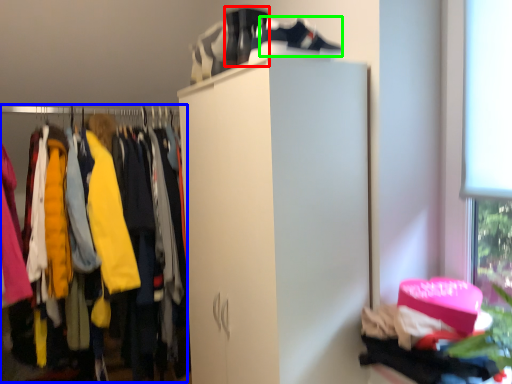
Question: Which object is the closest to the running shoe (highlighted by a red box)? Choose among these: closet (highlighted by a blue box) or shoe (highlighted by a green box).

Choices:
 (A) closet
 (B) shoe

Answer: (B)